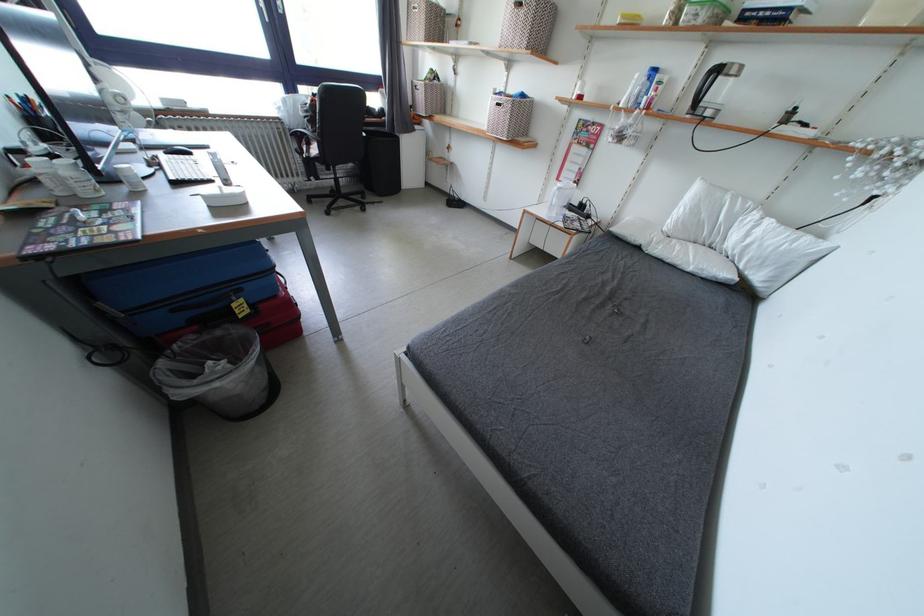
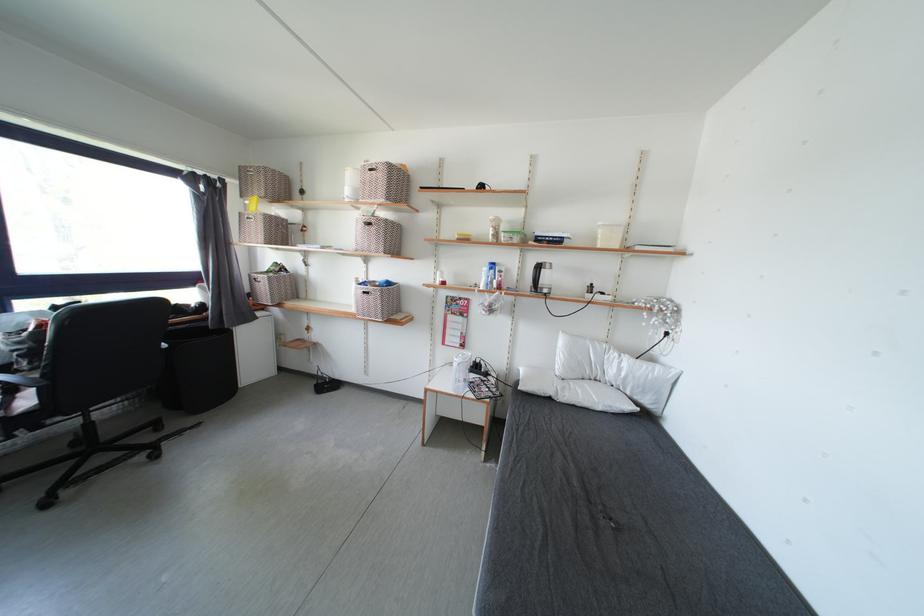
Based on the continuous images, in which direction is the camera rotating?

The camera's rotation is toward right-up.